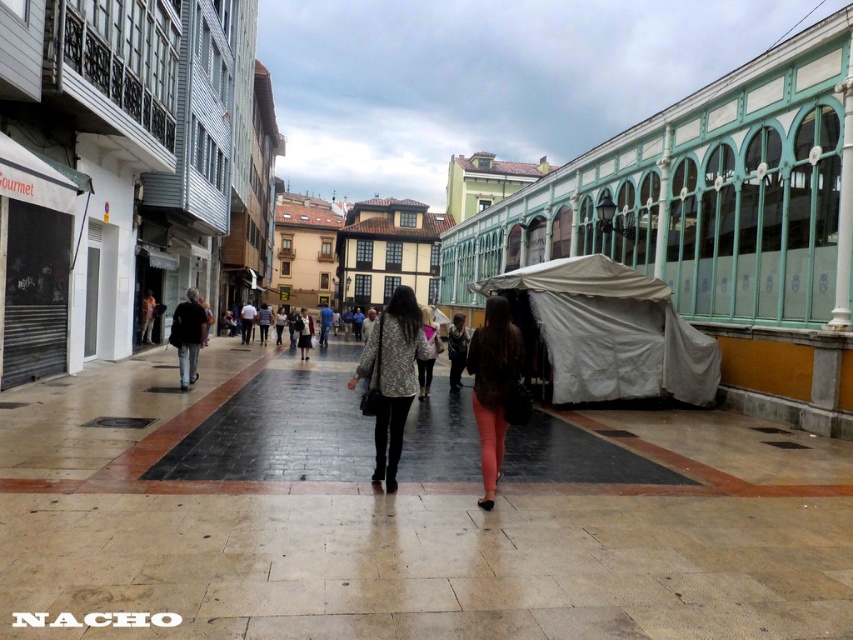
You are a delivery person trying to avoid stepping on the polished stone pavement at center while carrying a heavy box. Can you walk around it by moving to the side of the matte pink coat at center?

The polished stone pavement at center is not as tall as the matte pink coat at center, so you can walk around it by moving to the side of the matte pink coat at center since the pavement is lower and not an obstacle.

You are a delivery person carrying a box that is 1 meter wide. You need to walk through the street shown in the image. Can you pass through the area between the polished stone pavement at center and the matte pink coat at center without the box hitting anything?

The polished stone pavement at center might be wider than matte pink coat at center, so there is a possibility that the box could fit. However, since the exact width isn not provided, it is uncertain. Proceed with caution.